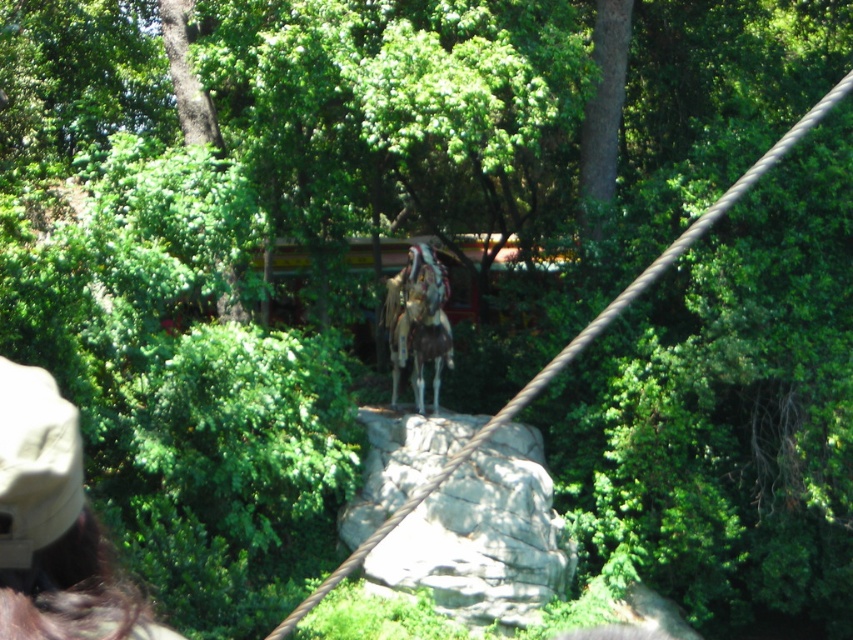
Is point (466, 518) farther from viewer compared to point (85, 620)?

Yes, point (466, 518) is behind point (85, 620).

Does gray rough rock at center appear over brown fabric cap at lower left?

No, gray rough rock at center is not above brown fabric cap at lower left.

Which is behind, point (416, 420) or point (85, 529)?

The point (416, 420) is behind.

Locate an element on the screen. The image size is (853, 640). gray rough rock at center is located at coordinates (485, 536).

Is brown fabric cap at lower left thinner than brown leather horse at center?

Yes, brown fabric cap at lower left is thinner than brown leather horse at center.

Looking at this image, who is positioned more to the right, brown fabric cap at lower left or brown leather horse at center?

brown fabric cap at lower left

Identify the location of brown fabric cap at lower left. The image size is (853, 640). (55, 525).

Does point (473, 566) lie in front of point (412, 348)?

Yes, point (473, 566) is in front of point (412, 348).

What do you see at coordinates (485, 536) in the screenshot?
I see `gray rough rock at center` at bounding box center [485, 536].

The height and width of the screenshot is (640, 853). What do you see at coordinates (485, 536) in the screenshot? I see `gray rough rock at center` at bounding box center [485, 536].

Where is `gray rough rock at center`? The image size is (853, 640). gray rough rock at center is located at coordinates (485, 536).